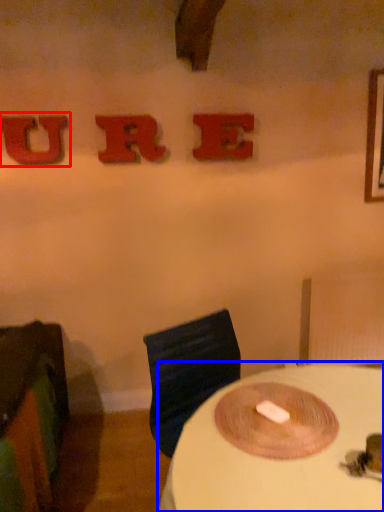
Question: Which of the following is the closest to the observer, alphabet (highlighted by a red box) or table (highlighted by a blue box)?

Choices:
 (A) alphabet
 (B) table

Answer: (B)